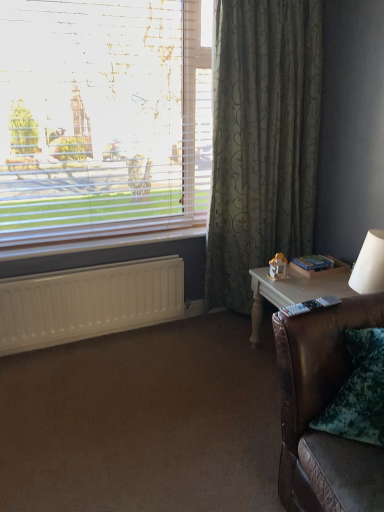
Question: From the image's perspective, is white plastic radiator at lower left located beneath brown leather couch at lower right?

Choices:
 (A) yes
 (B) no

Answer: (B)

Question: From a real-world perspective, is white plastic radiator at lower left over brown leather couch at lower right?

Choices:
 (A) no
 (B) yes

Answer: (B)

Question: Is white plastic radiator at lower left shorter than brown leather couch at lower right?

Choices:
 (A) yes
 (B) no

Answer: (A)

Question: Does white plastic radiator at lower left have a lesser width compared to brown leather couch at lower right?

Choices:
 (A) no
 (B) yes

Answer: (B)

Question: Considering the relative positions of white plastic radiator at lower left and brown leather couch at lower right in the image provided, is white plastic radiator at lower left to the left of brown leather couch at lower right from the viewer's perspective?

Choices:
 (A) no
 (B) yes

Answer: (B)

Question: Does white plastic radiator at lower left have a smaller size compared to brown leather couch at lower right?

Choices:
 (A) no
 (B) yes

Answer: (B)

Question: Is white blinds at upper left taller than white plastic radiator at lower left?

Choices:
 (A) yes
 (B) no

Answer: (A)

Question: Does white blinds at upper left have a larger size compared to white plastic radiator at lower left?

Choices:
 (A) yes
 (B) no

Answer: (A)

Question: From the image's perspective, does white blinds at upper left appear higher than white plastic radiator at lower left?

Choices:
 (A) no
 (B) yes

Answer: (B)

Question: Considering the relative sizes of white blinds at upper left and white plastic radiator at lower left in the image provided, is white blinds at upper left thinner than white plastic radiator at lower left?

Choices:
 (A) no
 (B) yes

Answer: (B)

Question: Is white blinds at upper left further to camera compared to white plastic radiator at lower left?

Choices:
 (A) no
 (B) yes

Answer: (A)

Question: From a real-world perspective, is white blinds at upper left over white plastic radiator at lower left?

Choices:
 (A) no
 (B) yes

Answer: (B)

Question: Is white wood table at right not near white plastic radiator at lower left?

Choices:
 (A) yes
 (B) no

Answer: (B)